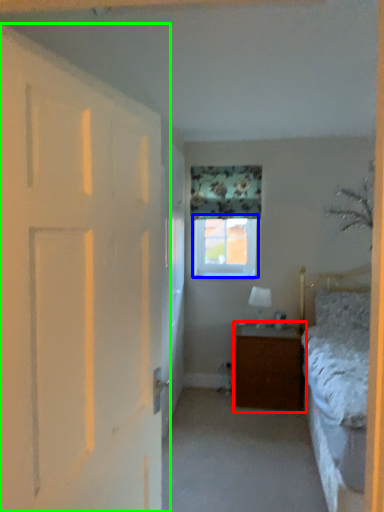
Question: Based on their relative distances, which object is farther from nightstand (highlighted by a red box)? Choose from window (highlighted by a blue box) and door (highlighted by a green box).

Choices:
 (A) window
 (B) door

Answer: (B)